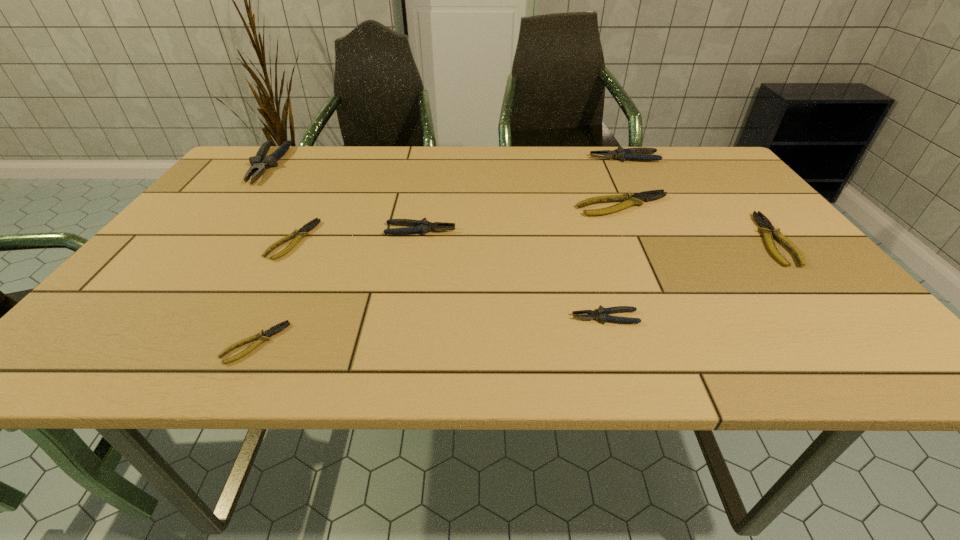
Find the location of `object located in the far left corner section of the desktop`. object located in the far left corner section of the desktop is located at coordinates (259, 163).

Find the location of a particular element. The height and width of the screenshot is (540, 960). free location at the far edge of the desktop is located at coordinates (596, 162).

Locate an element on the screen. The image size is (960, 540). vacant space at the near edge is located at coordinates (287, 342).

You are a GUI agent. You are given a task and a screenshot of the screen. Output one action in this format:
    pyautogui.click(x=<x>, y=<y>)
    Task: Click on the free space at the left edge
    This screenshot has width=960, height=540.
    Given the screenshot: What is the action you would take?
    pyautogui.click(x=136, y=303)

Locate an element on the screen. Image resolution: width=960 pixels, height=540 pixels. free region at the right edge is located at coordinates (786, 252).

In the image, there is a desktop. Where is `vacant space at the far left corner`? This screenshot has width=960, height=540. vacant space at the far left corner is located at coordinates (236, 167).

This screenshot has width=960, height=540. Find the location of `empty location between the rightmost yellow pliers and the third yellow pliers from left to right`. empty location between the rightmost yellow pliers and the third yellow pliers from left to right is located at coordinates (697, 222).

The height and width of the screenshot is (540, 960). Find the location of `empty space that is in between the third gray pliers from left to right and the leftmost gray pliers`. empty space that is in between the third gray pliers from left to right and the leftmost gray pliers is located at coordinates (436, 241).

Where is `vacant area that lies between the smallest gray pliers and the tallest pliers`? Image resolution: width=960 pixels, height=540 pixels. vacant area that lies between the smallest gray pliers and the tallest pliers is located at coordinates (436, 241).

Locate an element on the screen. This screenshot has height=540, width=960. vacant space that's between the shortest pliers and the rightmost gray pliers is located at coordinates (440, 251).